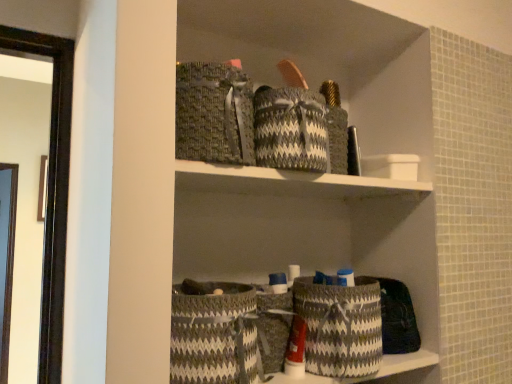
At what (x,y) coordinates should I click in order to perform the action: click on blank space situated above gray woven basket at lower center, which is the third basket from left to right (from a real-world perspective). Please return your answer as a coordinate pair (x, y). This screenshot has width=512, height=384. Looking at the image, I should click on (331, 278).